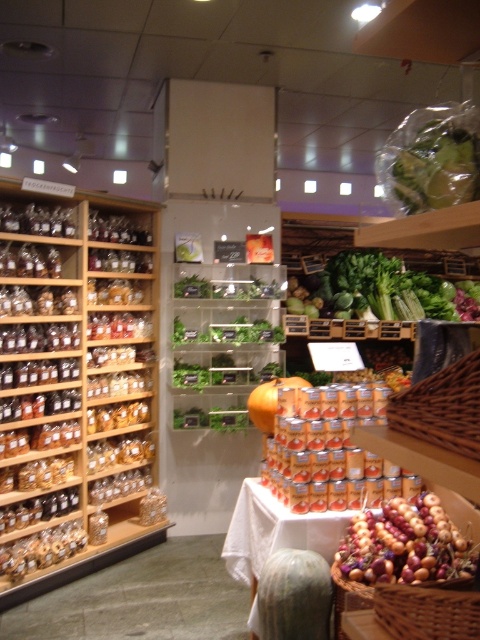
You are a grocery store employee who needs to arrange the items in the produce section. If you want to place the smooth brown onions at center and the green leafy at center on the same shelf, which item should be placed in a position that requires a smaller space?

The smooth brown onions at center should be placed in the position requiring smaller space since they are smaller in size compared to the green leafy at center.

You are a grocery store employee who needs to restock the smooth brown onions at center. The translucent glass jars at left are in the way. Can you move the jars to access the onions?

The translucent glass jars at left are positioned over the smooth brown onions at center, so you would need to move the jars first to access the onions.